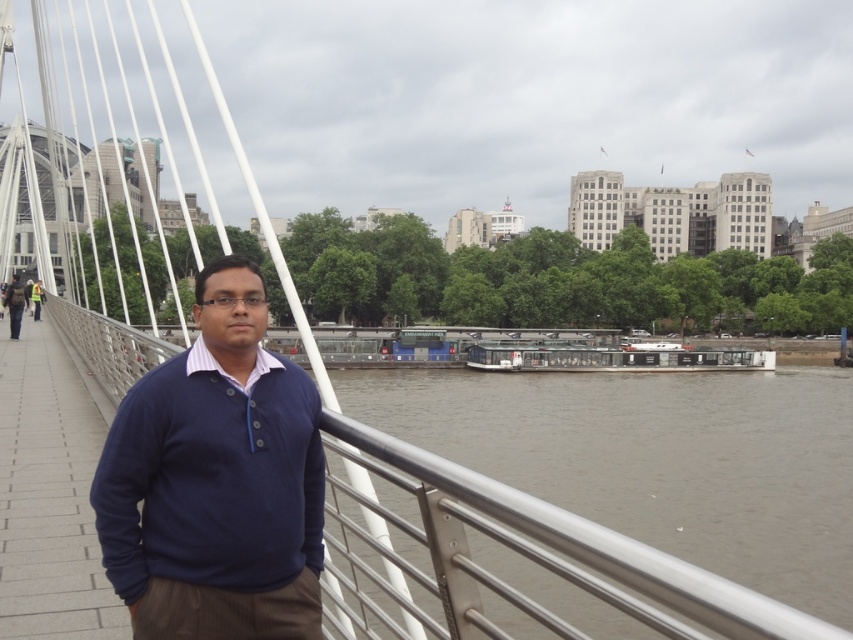
You are standing at the point marked as point (219, 262) on the bridge. You want to throw a small pebble to reach the ferry docked along the river edge. Considering the distance between you and the ferry is 40.29 meters, will the pebble reach the ferry if you can throw it up to 35 meters?

The distance between you and the ferry is 40.29 meters, which is farther than your throwing range of 35 meters. The pebble will not reach the ferry.

You are standing on the bridge and want to know which of the two points, point (282, 536) or point (508, 355), is closer to you. Can you determine this based on the scene?

Point (282, 536) is closer to the viewer than point (508, 355).